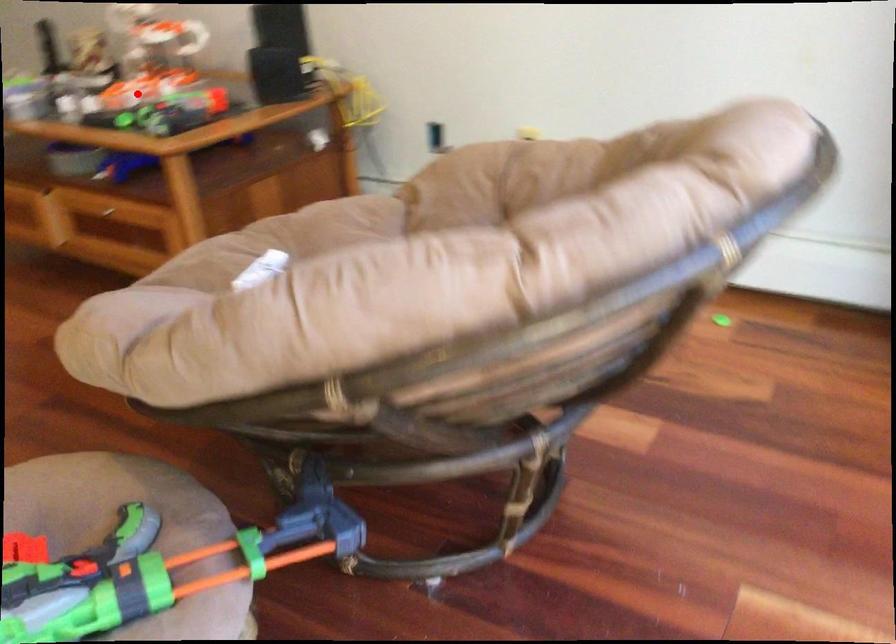
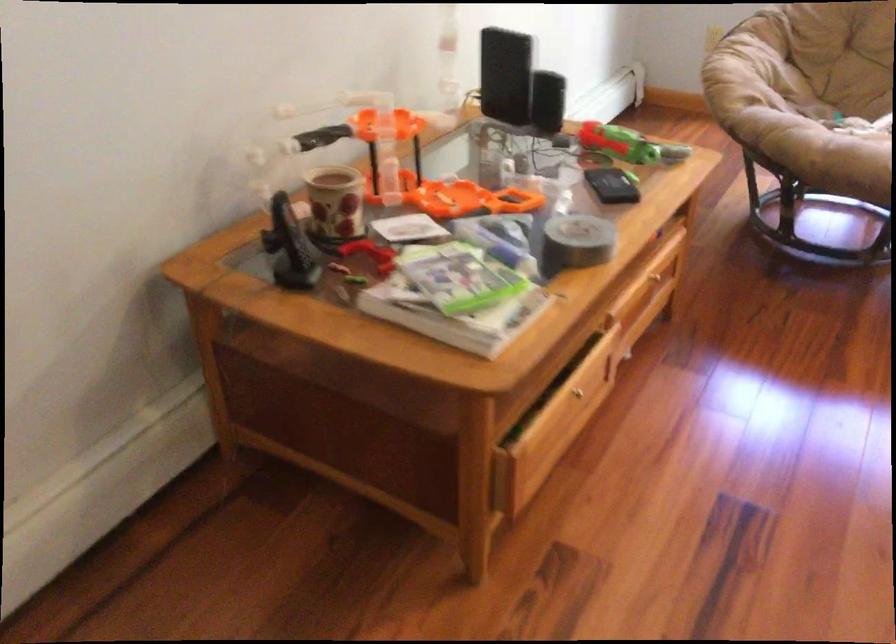
Locate, in the second image, the point that corresponds to the highlighted location in the first image.

(470, 199)